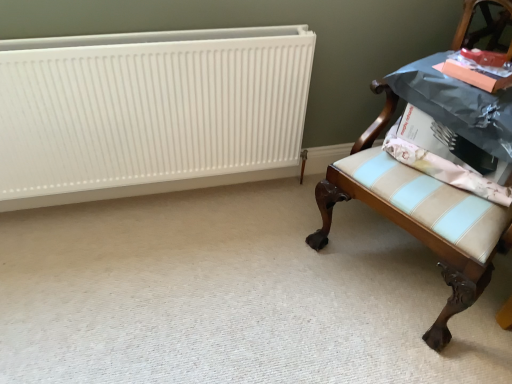
Question: From a real-world perspective, is light blue striped fabric at right below white matte radiator at upper left?

Choices:
 (A) yes
 (B) no

Answer: (B)

Question: Does light blue striped fabric at right have a greater width compared to white matte radiator at upper left?

Choices:
 (A) yes
 (B) no

Answer: (A)

Question: Is light blue striped fabric at right positioned with its back to white matte radiator at upper left?

Choices:
 (A) no
 (B) yes

Answer: (A)

Question: Can you confirm if light blue striped fabric at right is taller than white matte radiator at upper left?

Choices:
 (A) yes
 (B) no

Answer: (B)

Question: From the image's perspective, is light blue striped fabric at right located beneath white matte radiator at upper left?

Choices:
 (A) yes
 (B) no

Answer: (A)

Question: Considering the relative sizes of light blue striped fabric at right and white matte radiator at upper left in the image provided, is light blue striped fabric at right bigger than white matte radiator at upper left?

Choices:
 (A) no
 (B) yes

Answer: (A)

Question: Is white matte radiator at upper left behind light blue striped fabric at right?

Choices:
 (A) no
 (B) yes

Answer: (B)

Question: Is white matte radiator at upper left positioned with its back to light blue striped fabric at right?

Choices:
 (A) no
 (B) yes

Answer: (A)

Question: Considering the relative sizes of white matte radiator at upper left and light blue striped fabric at right in the image provided, is white matte radiator at upper left smaller than light blue striped fabric at right?

Choices:
 (A) no
 (B) yes

Answer: (A)

Question: Is white matte radiator at upper left in contact with light blue striped fabric at right?

Choices:
 (A) no
 (B) yes

Answer: (A)

Question: Is white matte radiator at upper left taller than light blue striped fabric at right?

Choices:
 (A) no
 (B) yes

Answer: (B)

Question: Is light blue striped fabric at right surrounded by white matte radiator at upper left?

Choices:
 (A) yes
 (B) no

Answer: (B)

Question: Is white matte radiator at upper left positioned before wooden upholstered chair at right?

Choices:
 (A) no
 (B) yes

Answer: (A)